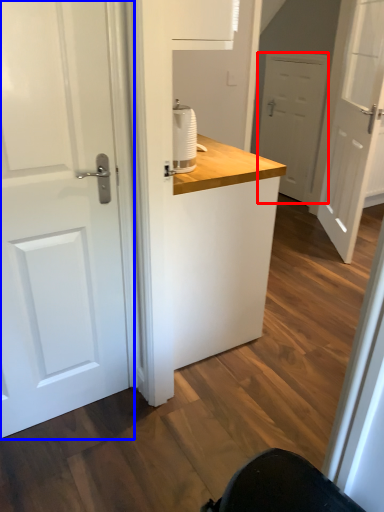
Question: Which object is closer to the camera taking this photo, door (highlighted by a red box) or door (highlighted by a blue box)?

Choices:
 (A) door
 (B) door

Answer: (B)